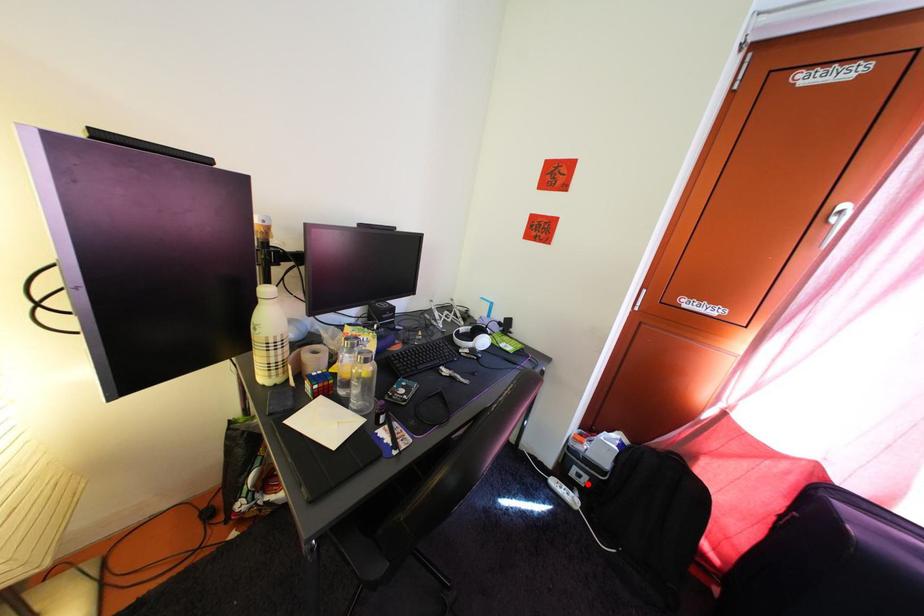
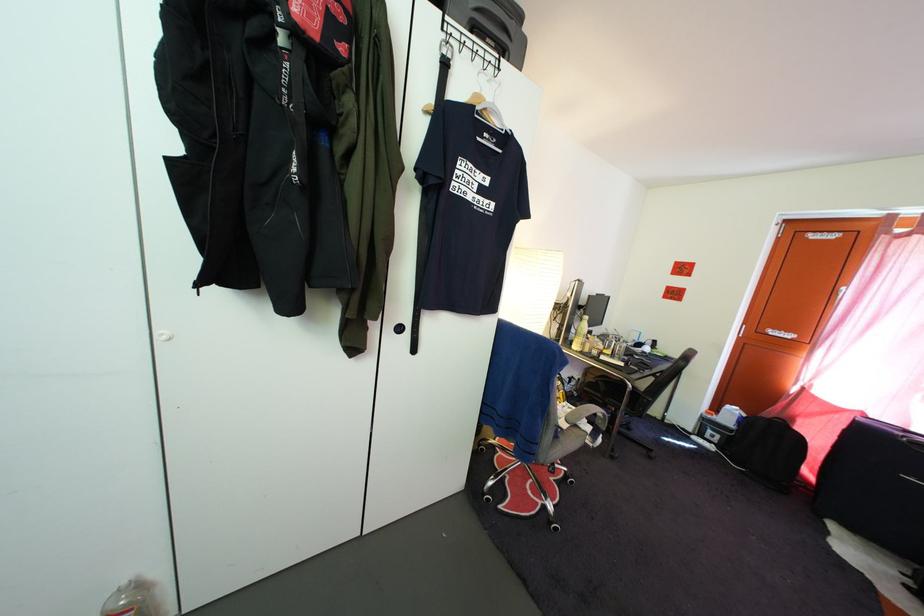
Question: I am providing you with two images of the same scene from different viewpoints. Image1 has a red point marked. In image2, the corresponding 3D location appears at what relative position? Reply with the corresponding letter.

Choices:
 (A) Closer
 (B) Farther

Answer: (A)